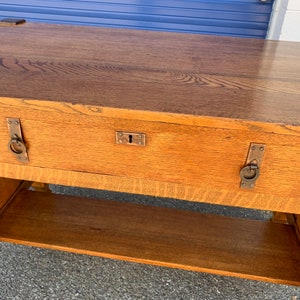
I want to click on front wood, drawer, so tap(70, 149).